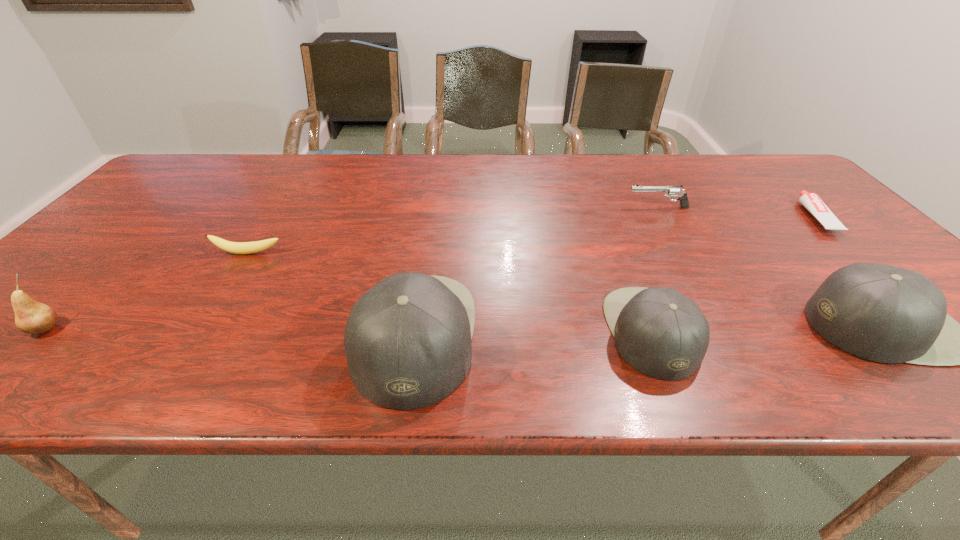
At what (x,y) coordinates should I click in order to perform the action: click on free location located on the upward curve of the sixth tallest object. Please return your answer as a coordinate pair (x, y). This screenshot has height=540, width=960. Looking at the image, I should click on (211, 312).

You are a GUI agent. You are given a task and a screenshot of the screen. Output one action in this format:
    pyautogui.click(x=<x>, y=<y>)
    Task: Click on the vacant space located 0.290m on the front-facing side of the pistol
    
    Given the screenshot: What is the action you would take?
    pyautogui.click(x=525, y=207)

At what (x,y) coordinates should I click in order to perform the action: click on free space located on the front-facing side of the pistol. Please return your answer as a coordinate pair (x, y). The image size is (960, 540). Looking at the image, I should click on (508, 207).

Identify the location of blank area located 0.150m on the front-facing side of the pistol. This screenshot has width=960, height=540. (574, 207).

Where is `free spot located on the back of the pear`? The height and width of the screenshot is (540, 960). free spot located on the back of the pear is located at coordinates (79, 295).

Identify the location of pear positioned at the near edge. This screenshot has width=960, height=540. (31, 317).

Identify the location of object at the left edge. [x=31, y=317].

Identify the location of object at the right edge. The height and width of the screenshot is (540, 960). (811, 201).

Find the location of a particular element. Image resolution: width=960 pixels, height=540 pixels. object at the near left corner is located at coordinates (31, 317).

At what (x,y) coordinates should I click in order to perform the action: click on vacant space at the far edge. Please return your answer as a coordinate pair (x, y). This screenshot has width=960, height=540. Looking at the image, I should click on (244, 168).